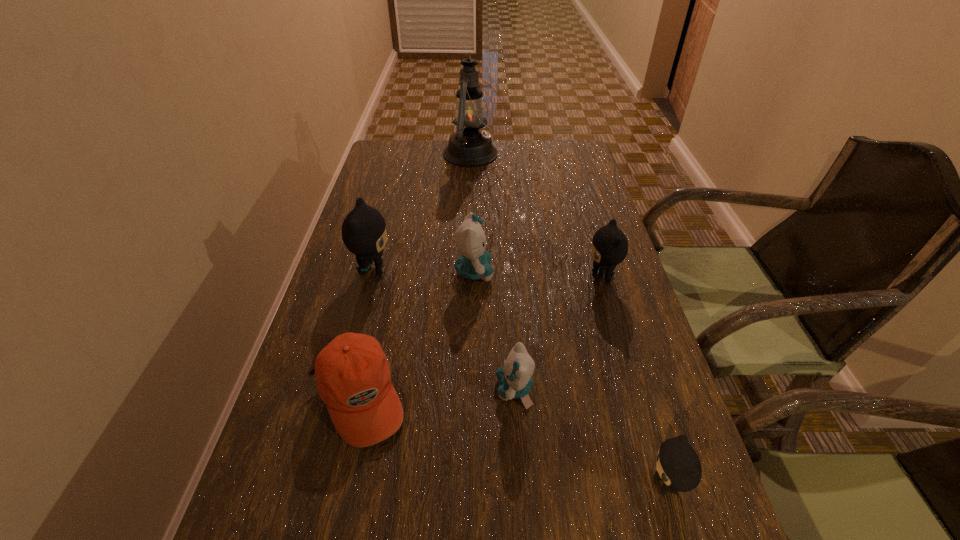
The height and width of the screenshot is (540, 960). I want to click on unoccupied area between the second biggest gray kitten and the baseball cap, so click(480, 336).

Locate an element on the screen. This screenshot has height=540, width=960. free area in between the second smallest gray kitten and the smaller blue kitten is located at coordinates (558, 333).

Where is `vacant area that lies between the baseball cap and the nearest object`? This screenshot has height=540, width=960. vacant area that lies between the baseball cap and the nearest object is located at coordinates (512, 441).

You are a GUI agent. You are given a task and a screenshot of the screen. Output one action in this format:
    pyautogui.click(x=<x>, y=<y>)
    Task: Click on the fourth closest object relative to the farthest object
    The height and width of the screenshot is (540, 960).
    Given the screenshot: What is the action you would take?
    pyautogui.click(x=353, y=376)

Identify which object is the sixth nearest to the biggest gray kitten. Please provide its 2D coordinates. Your answer should be formatted as a tuple, i.e. [(x, y)], where the tuple contains the x and y coordinates of a point satisfying the conditions above.

[(678, 466)]

Locate which kitten is the closest to the nearest gray kitten. Please provide its 2D coordinates. Your answer should be formatted as a tuple, i.e. [(x, y)], where the tuple contains the x and y coordinates of a point satisfying the conditions above.

[(515, 379)]

This screenshot has height=540, width=960. I want to click on kitten that can be found as the closest to the smallest gray kitten, so click(515, 379).

Identify which gray kitten is located as the second nearest to the smaller blue kitten. Please provide its 2D coordinates. Your answer should be formatted as a tuple, i.e. [(x, y)], where the tuple contains the x and y coordinates of a point satisfying the conditions above.

[(609, 244)]

I want to click on the third closest gray kitten relative to the nearer blue kitten, so click(364, 232).

I want to click on free space that satisfies the following two spatial constraints: 1. on the front-facing side of the baseball cap; 2. on the left side of the leftmost kitten, so click(340, 396).